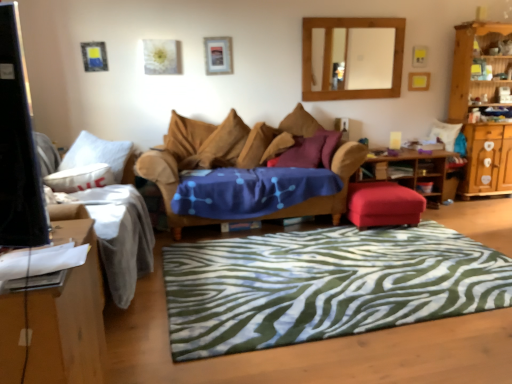
Question: Which direction should I rotate to look at purple fabric pillow at center, the 4th pillow when ordered from left to right?

Choices:
 (A) left
 (B) right

Answer: (B)

Question: Is white fabric couch at left, positioned as the second studio couch in right-to-left order, shorter than brown fabric pillow at center, the 2th pillow from the left?

Choices:
 (A) no
 (B) yes

Answer: (A)

Question: From the image's perspective, does white fabric couch at left, positioned as the second studio couch in right-to-left order, appear lower than brown fabric pillow at center, the 2th pillow from the left?

Choices:
 (A) yes
 (B) no

Answer: (A)

Question: Is white fabric couch at left, positioned as the second studio couch in right-to-left order, aimed at brown fabric pillow at center, the 2th pillow from the left?

Choices:
 (A) yes
 (B) no

Answer: (A)

Question: Is the depth of white fabric couch at left, the 1th studio couch in the left-to-right sequence, greater than that of brown fabric pillow at center, the 2th pillow from the left?

Choices:
 (A) yes
 (B) no

Answer: (B)

Question: Is white fabric couch at left, positioned as the second studio couch in right-to-left order, oriented away from brown fabric pillow at center, arranged as the third pillow when viewed from the right?

Choices:
 (A) no
 (B) yes

Answer: (A)

Question: Is white fabric couch at left, positioned as the second studio couch in right-to-left order, in contact with brown fabric pillow at center, arranged as the third pillow when viewed from the right?

Choices:
 (A) yes
 (B) no

Answer: (B)

Question: Is the depth of brown fabric pillow at center, positioned as the 3th pillow in left-to-right order, less than that of white fabric couch at left, positioned as the second studio couch in right-to-left order?

Choices:
 (A) no
 (B) yes

Answer: (A)

Question: Can you confirm if brown fabric pillow at center, positioned as the 3th pillow in left-to-right order, is positioned to the right of white fabric couch at left, the 1th studio couch in the left-to-right sequence?

Choices:
 (A) yes
 (B) no

Answer: (A)

Question: Is the depth of brown fabric pillow at center, positioned as the 3th pillow in left-to-right order, greater than that of white fabric couch at left, the 1th studio couch in the left-to-right sequence?

Choices:
 (A) yes
 (B) no

Answer: (A)

Question: From a real-world perspective, does brown fabric pillow at center, the 2th pillow positioned from the right, sit lower than white fabric couch at left, the 1th studio couch in the left-to-right sequence?

Choices:
 (A) yes
 (B) no

Answer: (B)

Question: Considering the relative sizes of brown fabric pillow at center, the 2th pillow positioned from the right, and white fabric couch at left, positioned as the second studio couch in right-to-left order, in the image provided, is brown fabric pillow at center, the 2th pillow positioned from the right, smaller than white fabric couch at left, positioned as the second studio couch in right-to-left order,?

Choices:
 (A) yes
 (B) no

Answer: (A)

Question: Is brown fabric pillow at center, the 2th pillow positioned from the right, oriented away from white fabric couch at left, positioned as the second studio couch in right-to-left order?

Choices:
 (A) yes
 (B) no

Answer: (B)

Question: Can you confirm if brown fabric pillow at center, the 2th pillow from the left, is shorter than metallic silver picture frame at upper center?

Choices:
 (A) no
 (B) yes

Answer: (A)